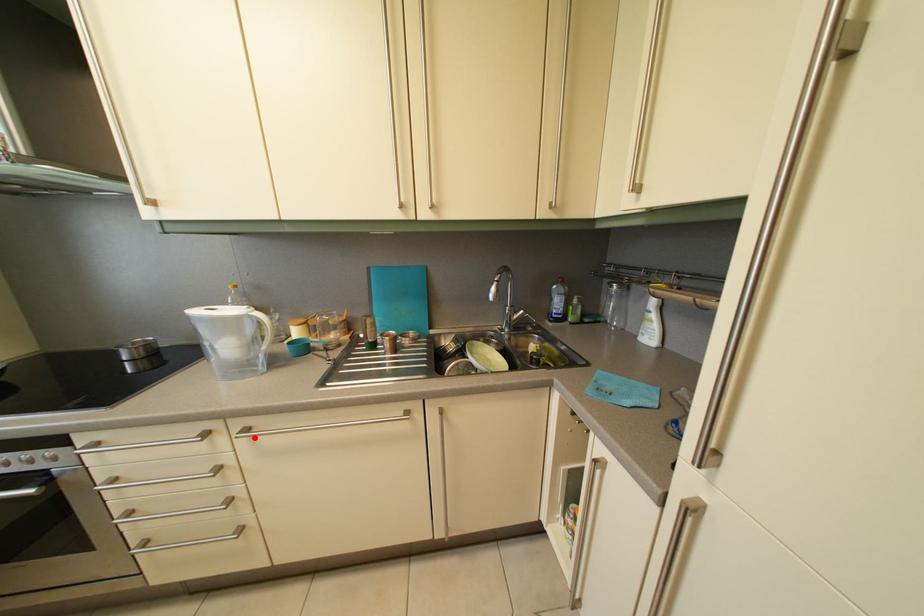
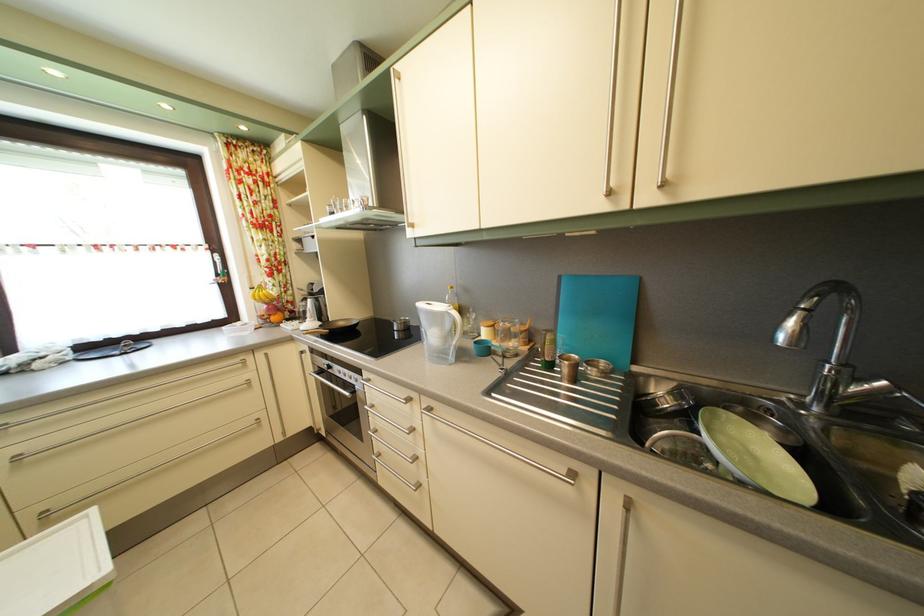
The point at the highlighted location is marked in the first image. Where is the corresponding point in the second image?

(438, 416)